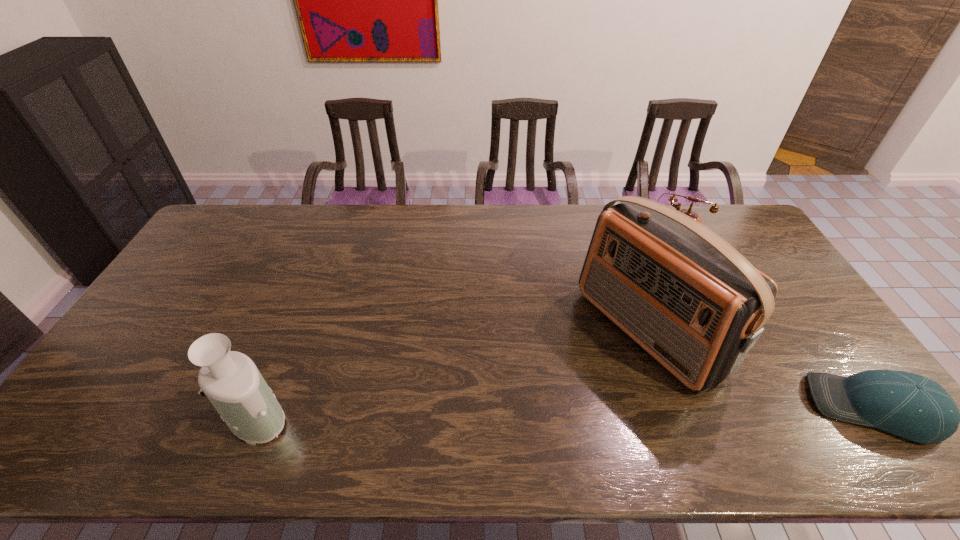
The height and width of the screenshot is (540, 960). I want to click on free space located on the front-facing side of the tallest object, so 555,398.

The height and width of the screenshot is (540, 960). Find the location of `blank area located on the front-facing side of the tallest object`. blank area located on the front-facing side of the tallest object is located at coordinates (548, 402).

Find the location of a particular element. This screenshot has height=540, width=960. object at the far edge is located at coordinates (714, 208).

You are a GUI agent. You are given a task and a screenshot of the screen. Output one action in this format:
    pyautogui.click(x=<x>, y=<y>)
    Task: Click on the juicer situated at the near edge
    This screenshot has height=540, width=960.
    Given the screenshot: What is the action you would take?
    pyautogui.click(x=231, y=381)

Locate an element on the screen. radio receiver positioned at the near edge is located at coordinates (687, 297).

Image resolution: width=960 pixels, height=540 pixels. I want to click on blank space at the far edge of the desktop, so click(426, 233).

The width and height of the screenshot is (960, 540). In the image, there is a desktop. In order to click on vacant space at the near edge in this screenshot , I will do `click(296, 408)`.

At what (x,y) coordinates should I click in order to perform the action: click on vacant region at the right edge. Please return your answer as a coordinate pair (x, y). Image resolution: width=960 pixels, height=540 pixels. Looking at the image, I should click on (789, 354).

Find the location of a particular element. Image resolution: width=960 pixels, height=540 pixels. vacant space that's between the leftmost object and the radio receiver is located at coordinates (451, 373).

You are a GUI agent. You are given a task and a screenshot of the screen. Output one action in this format:
    pyautogui.click(x=<x>, y=<y>)
    Task: Click on the vacant region between the tallest object and the second tallest object
    This screenshot has width=960, height=540.
    Given the screenshot: What is the action you would take?
    pyautogui.click(x=451, y=373)